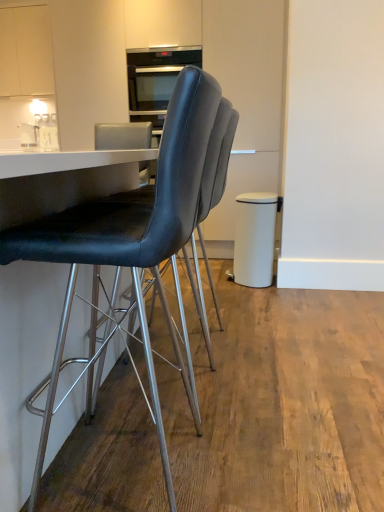
Question: Does white matte trash can at right have a greater height compared to white glossy salt shaker at upper left, which is the 2th appliance from right to left?

Choices:
 (A) no
 (B) yes

Answer: (B)

Question: Is white matte trash can at right facing away from white glossy salt shaker at upper left, marked as the 1th appliance in a back-to-front arrangement?

Choices:
 (A) yes
 (B) no

Answer: (B)

Question: From the image's perspective, is white matte trash can at right located beneath white glossy salt shaker at upper left, which is the 2th appliance from right to left?

Choices:
 (A) no
 (B) yes

Answer: (B)

Question: Is white glossy salt shaker at upper left, which is the 2th appliance from right to left, surrounded by white matte trash can at right?

Choices:
 (A) no
 (B) yes

Answer: (A)

Question: From a real-world perspective, is white matte trash can at right physically above white glossy salt shaker at upper left, which is the 2th appliance from right to left?

Choices:
 (A) no
 (B) yes

Answer: (A)

Question: Is white matte trash can at right wider than white glossy salt shaker at upper left, marked as the 1th appliance in a back-to-front arrangement?

Choices:
 (A) yes
 (B) no

Answer: (A)

Question: Can you confirm if white glossy salt shaker at upper left, marked as the 1th appliance in a back-to-front arrangement, is wider than white matte cabinet at upper left?

Choices:
 (A) yes
 (B) no

Answer: (B)

Question: Is white glossy salt shaker at upper left, the 2th appliance from the front, completely or partially outside of white matte cabinet at upper left?

Choices:
 (A) yes
 (B) no

Answer: (A)

Question: Can you confirm if white glossy salt shaker at upper left, which is the 2th appliance from right to left, is thinner than white matte cabinet at upper left?

Choices:
 (A) no
 (B) yes

Answer: (B)

Question: Is white glossy salt shaker at upper left, marked as the 1th appliance in a back-to-front arrangement, positioned far away from white matte cabinet at upper left?

Choices:
 (A) yes
 (B) no

Answer: (B)

Question: From the image's perspective, does white glossy salt shaker at upper left, marked as the 1th appliance in a back-to-front arrangement, appear higher than white matte cabinet at upper left?

Choices:
 (A) yes
 (B) no

Answer: (B)

Question: From a real-world perspective, is white glossy salt shaker at upper left, which is the 2th appliance from right to left, physically above white matte cabinet at upper left?

Choices:
 (A) yes
 (B) no

Answer: (B)

Question: From a real-world perspective, does black leather chair at center, placed as the 2th chair when sorted from front to back, stand above white matte trash can at right?

Choices:
 (A) yes
 (B) no

Answer: (A)